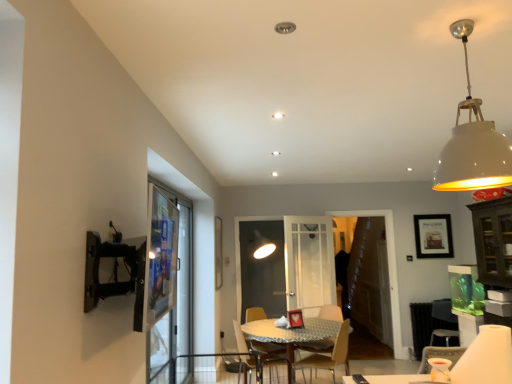
Question: Is wooden chair at center, which is the second chair from left to right, turned away from matte black picture frame at upper right?

Choices:
 (A) yes
 (B) no

Answer: (B)

Question: Is wooden chair at center, the first chair when ordered from right to left, behind matte black picture frame at upper right?

Choices:
 (A) no
 (B) yes

Answer: (A)

Question: Does wooden chair at center, which is the second chair from left to right, have a greater height compared to matte black picture frame at upper right?

Choices:
 (A) no
 (B) yes

Answer: (B)

Question: From a real-world perspective, is wooden chair at center, which is the second chair from left to right, positioned over matte black picture frame at upper right based on gravity?

Choices:
 (A) no
 (B) yes

Answer: (A)

Question: Are wooden chair at center, the first chair when ordered from right to left, and matte black picture frame at upper right beside each other?

Choices:
 (A) yes
 (B) no

Answer: (B)

Question: From a real-world perspective, is wooden table at center above or below transparent glass screen door at center, placed as the third screen door when sorted from left to right?

Choices:
 (A) below
 (B) above

Answer: (A)

Question: Is wooden table at center bigger or smaller than transparent glass screen door at center, placed as the third screen door when sorted from left to right?

Choices:
 (A) big
 (B) small

Answer: (A)

Question: Is wooden table at center in front of or behind transparent glass screen door at center, placed as the third screen door when sorted from left to right, in the image?

Choices:
 (A) front
 (B) behind

Answer: (A)

Question: Is wooden table at center taller or shorter than transparent glass screen door at center, the first screen door in the right-to-left sequence?

Choices:
 (A) short
 (B) tall

Answer: (A)

Question: In terms of width, does white matte lampshade at upper right look wider or thinner when compared to transparent glass screen door at left, the 3th screen door in the back-to-front sequence?

Choices:
 (A) thin
 (B) wide

Answer: (B)

Question: From a real-world perspective, relative to transparent glass screen door at left, which appears as the first screen door when viewed from the front, is white matte lampshade at upper right vertically above or below?

Choices:
 (A) above
 (B) below

Answer: (A)

Question: Considering the relative positions of white matte lampshade at upper right and transparent glass screen door at left, which is the first screen door from left to right, in the image provided, is white matte lampshade at upper right to the left or to the right of transparent glass screen door at left, which is the first screen door from left to right,?

Choices:
 (A) right
 (B) left

Answer: (A)

Question: Is white matte lampshade at upper right in front of or behind transparent glass screen door at left, the 3th screen door in the back-to-front sequence, in the image?

Choices:
 (A) front
 (B) behind

Answer: (A)

Question: From the image's perspective, relative to transparent glass screen door at center, positioned as the 2th screen door in left-to-right order, is wooden table at center above or below?

Choices:
 (A) above
 (B) below

Answer: (B)

Question: Based on their sizes in the image, would you say wooden table at center is bigger or smaller than transparent glass screen door at center, positioned as the 2th screen door in left-to-right order?

Choices:
 (A) big
 (B) small

Answer: (A)